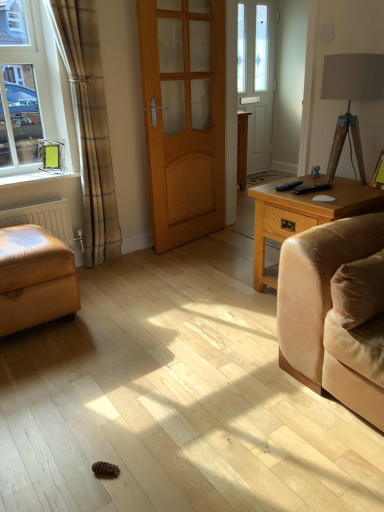
The height and width of the screenshot is (512, 384). What are the coordinates of `vacant area located to the right-hand side of plaid fabric curtain at left` in the screenshot? It's located at (142, 262).